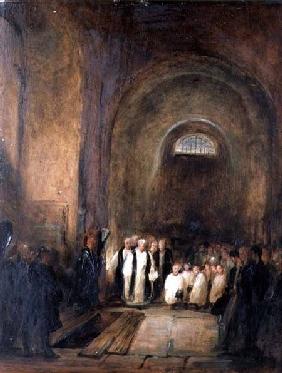
What are the coordinates of `half circle shaped window above door` in the screenshot? It's located at (197, 147).